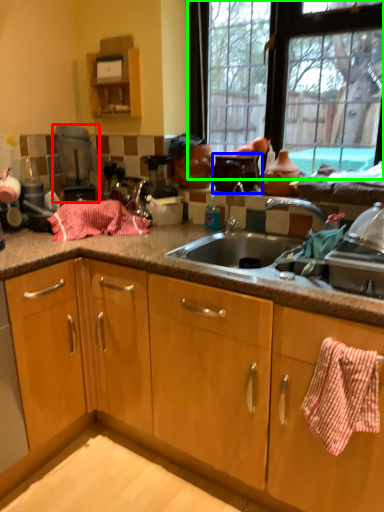
Question: Which object is the farthest from appliance (highlighted by a red box)? Choose among these: appliance (highlighted by a blue box) or window (highlighted by a green box).

Choices:
 (A) appliance
 (B) window

Answer: (B)